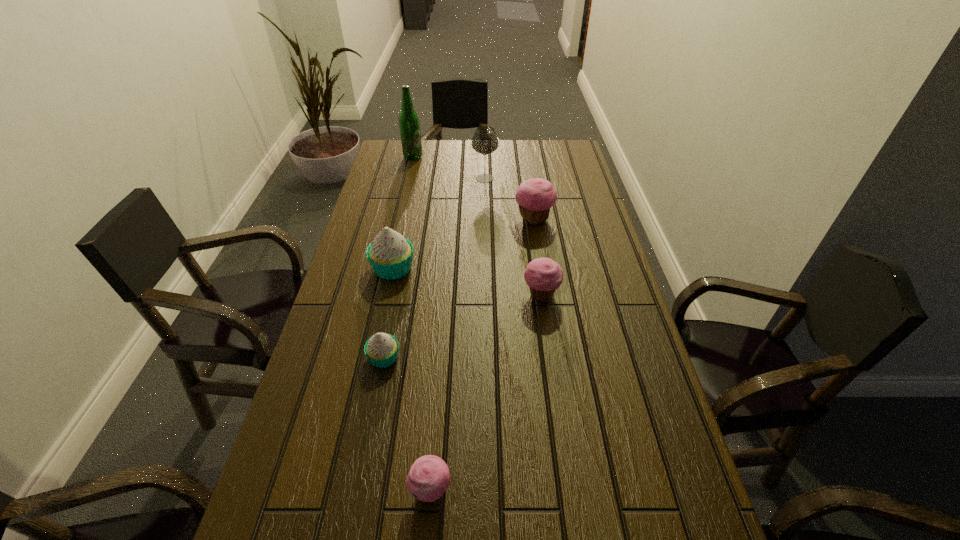
You are a GUI agent. You are given a task and a screenshot of the screen. Output one action in this format:
    pyautogui.click(x=<x>, y=<y>)
    Task: Click on the tallest object
    The height and width of the screenshot is (540, 960).
    Given the screenshot: What is the action you would take?
    pyautogui.click(x=409, y=124)

Locate an element on the screen. The width and height of the screenshot is (960, 540). beer bottle is located at coordinates tap(409, 124).

The height and width of the screenshot is (540, 960). I want to click on wineglass, so click(x=485, y=141).

This screenshot has height=540, width=960. In order to click on the second tallest object in this screenshot , I will do `click(485, 141)`.

Identify the location of the farthest cupcake. (535, 197).

The height and width of the screenshot is (540, 960). In order to click on the farthest pink cupcake in this screenshot , I will do `click(535, 197)`.

At what (x,y) coordinates should I click in order to perform the action: click on the farther white cupcake. Please return your answer as a coordinate pair (x, y). Looking at the image, I should click on (390, 255).

The height and width of the screenshot is (540, 960). What are the coordinates of `the second nearest pink cupcake` in the screenshot? It's located at (543, 275).

Find the location of a particular element. This screenshot has height=540, width=960. the second biggest pink cupcake is located at coordinates (543, 275).

Image resolution: width=960 pixels, height=540 pixels. I want to click on the second nearest object, so click(x=381, y=349).